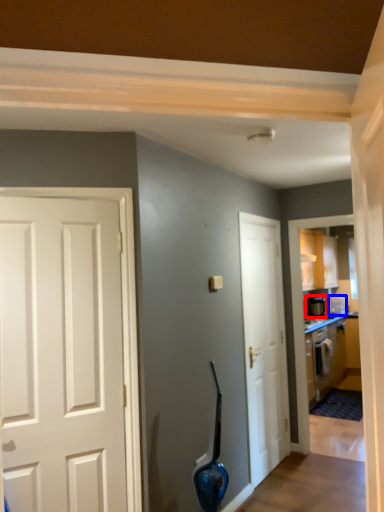
Question: Which of the following is the farthest to the observer, appliance (highlighted by a red box) or appliance (highlighted by a blue box)?

Choices:
 (A) appliance
 (B) appliance

Answer: (B)